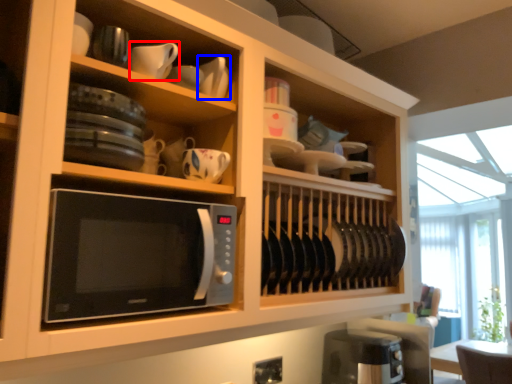
Question: Which of the following is the farthest to the observer, tableware (highlighted by a red box) or tableware (highlighted by a blue box)?

Choices:
 (A) tableware
 (B) tableware

Answer: (B)